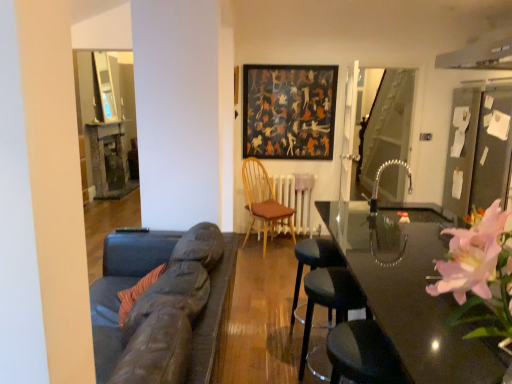
Question: Are glossy black table at center and dark gray fabric bar stool at center beside each other?

Choices:
 (A) yes
 (B) no

Answer: (B)

Question: From the image's perspective, would you say glossy black table at center is positioned over dark gray fabric bar stool at center?

Choices:
 (A) no
 (B) yes

Answer: (A)

Question: Is glossy black table at center positioned behind dark gray fabric bar stool at center?

Choices:
 (A) yes
 (B) no

Answer: (B)

Question: Considering the relative sizes of glossy black table at center and dark gray fabric bar stool at center in the image provided, is glossy black table at center taller than dark gray fabric bar stool at center?

Choices:
 (A) yes
 (B) no

Answer: (A)

Question: From the image's perspective, is glossy black table at center beneath dark gray fabric bar stool at center?

Choices:
 (A) yes
 (B) no

Answer: (A)

Question: Considering the relative positions of wooden chair with brown cushion at center, which ranks as the second chair in front-to-back order, and black leather swivel chair at lower right in the image provided, is wooden chair with brown cushion at center, which ranks as the second chair in front-to-back order, to the left or to the right of black leather swivel chair at lower right?

Choices:
 (A) right
 (B) left

Answer: (B)

Question: Is point (247, 160) closer or farther from the camera than point (361, 336)?

Choices:
 (A) farther
 (B) closer

Answer: (A)

Question: From their relative heights in the image, would you say wooden chair with brown cushion at center, which ranks as the second chair in front-to-back order, is taller or shorter than black leather swivel chair at lower right?

Choices:
 (A) short
 (B) tall

Answer: (B)

Question: Is wooden chair with brown cushion at center, arranged as the first chair when viewed from the back, in front of or behind black leather swivel chair at lower right in the image?

Choices:
 (A) front
 (B) behind

Answer: (B)

Question: Based on their positions, is transparent glass door at right located to the left or right of glossy black table at center?

Choices:
 (A) right
 (B) left

Answer: (A)

Question: Considering the positions of transparent glass door at right and glossy black table at center in the image, is transparent glass door at right taller or shorter than glossy black table at center?

Choices:
 (A) short
 (B) tall

Answer: (B)

Question: Looking at the image, does transparent glass door at right seem bigger or smaller compared to glossy black table at center?

Choices:
 (A) small
 (B) big

Answer: (A)

Question: Considering the positions of transparent glass door at right and glossy black table at center in the image, is transparent glass door at right wider or thinner than glossy black table at center?

Choices:
 (A) thin
 (B) wide

Answer: (A)

Question: In terms of width, does dark textured painting at upper center look wider or thinner when compared to wooden chair with brown cushion at center, which ranks as the second chair in front-to-back order?

Choices:
 (A) thin
 (B) wide

Answer: (A)

Question: In terms of size, does dark textured painting at upper center appear bigger or smaller than wooden chair with brown cushion at center, arranged as the first chair when viewed from the back?

Choices:
 (A) big
 (B) small

Answer: (B)